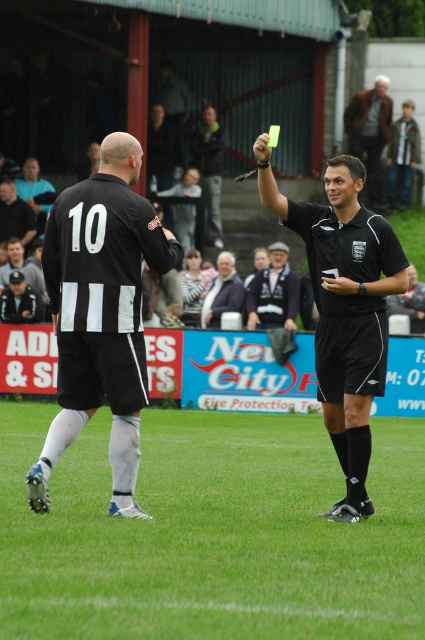
How distant is green grass at center from light brown leather jacket at upper center?

green grass at center is 6.89 meters from light brown leather jacket at upper center.

I want to click on green grass at center, so click(x=212, y=532).

Between dark gray fabric jacket at left and dark gray jersey at left, which one is positioned higher?

dark gray jersey at left is above.

Who is more forward, (17, 284) or (23, 173)?

Positioned in front is point (17, 284).

What are the coordinates of `dark gray fabric jacket at left` in the screenshot? It's located at (19, 301).

Is black matte jersey at center taller than dark blue fabric jacket at center?

Correct, black matte jersey at center is much taller as dark blue fabric jacket at center.

Between point (133, 513) and point (248, 296), which one is positioned behind?

The point (248, 296) is behind.

This screenshot has width=425, height=640. Identify the location of black matte jersey at center. (101, 314).

Find the location of a particular element. Image resolution: width=425 pixels, height=640 pixels. black matte jersey at center is located at coordinates (101, 314).